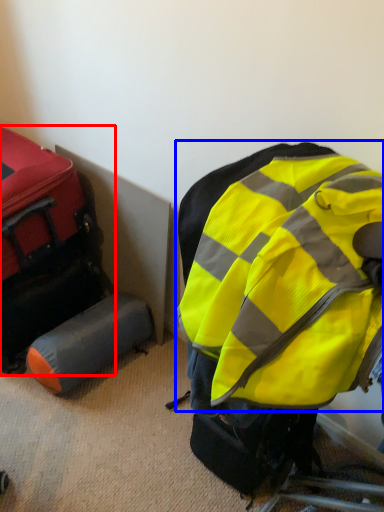
Question: Which of the following is the farthest to the observer, luggage and bags (highlighted by a red box) or backpack (highlighted by a blue box)?

Choices:
 (A) luggage and bags
 (B) backpack

Answer: (A)